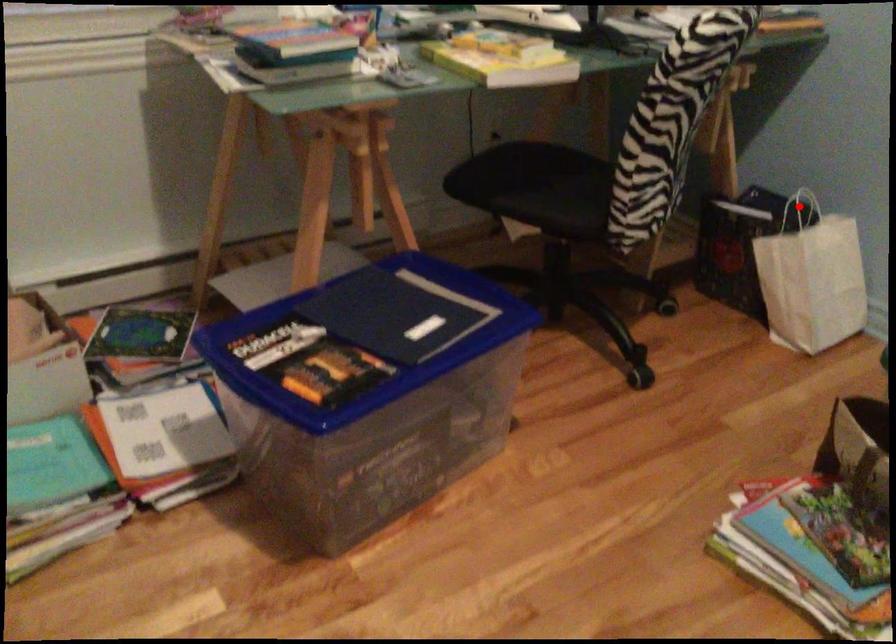
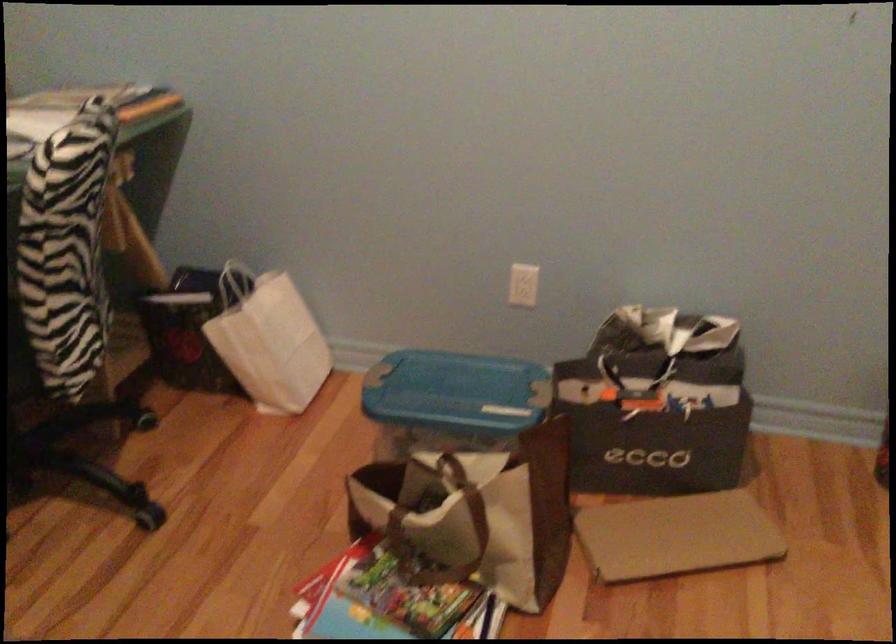
Where in the second image is the point corresponding to the highlighted location from the first image?

(236, 281)